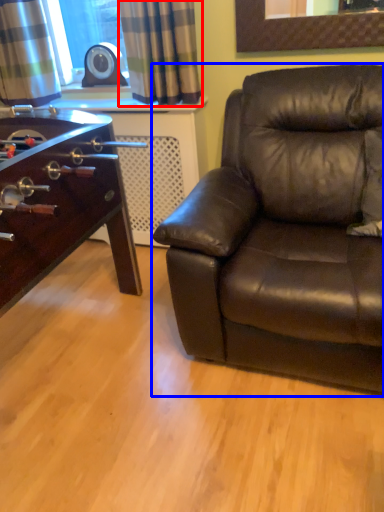
Question: Which object appears closest to the camera in this image, curtain (highlighted by a red box) or studio couch (highlighted by a blue box)?

Choices:
 (A) curtain
 (B) studio couch

Answer: (B)